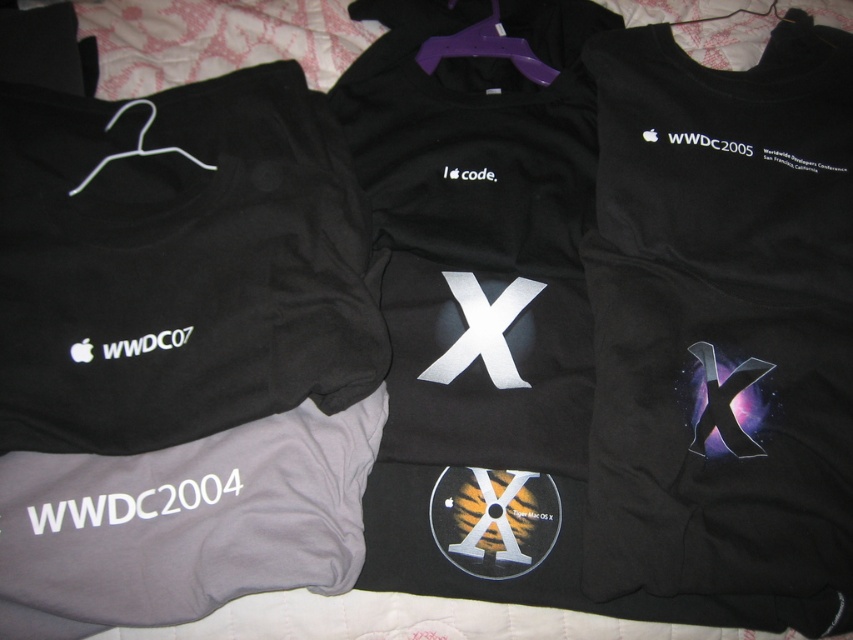
Question: Can you confirm if black matte t-shirt at center is thinner than gray cotton t-shirt at lower left?

Choices:
 (A) yes
 (B) no

Answer: (A)

Question: Which object appears farthest from the camera in this image?

Choices:
 (A) black matte t-shirt at center
 (B) gray cotton t-shirt at lower left
 (C) black matte sweatshirt at center

Answer: (A)

Question: Which of the following is the closest to the observer?

Choices:
 (A) (210, 468)
 (B) (535, 458)
 (C) (846, 588)

Answer: (C)

Question: Is black matte sweatshirt at center below black matte t-shirt at center?

Choices:
 (A) yes
 (B) no

Answer: (A)

Question: Does black matte sweatshirt at center have a lesser width compared to gray cotton t-shirt at lower left?

Choices:
 (A) yes
 (B) no

Answer: (A)

Question: Which point is farther from the camera taking this photo?

Choices:
 (A) (405, 486)
 (B) (773, 424)
 (C) (223, 595)

Answer: (A)